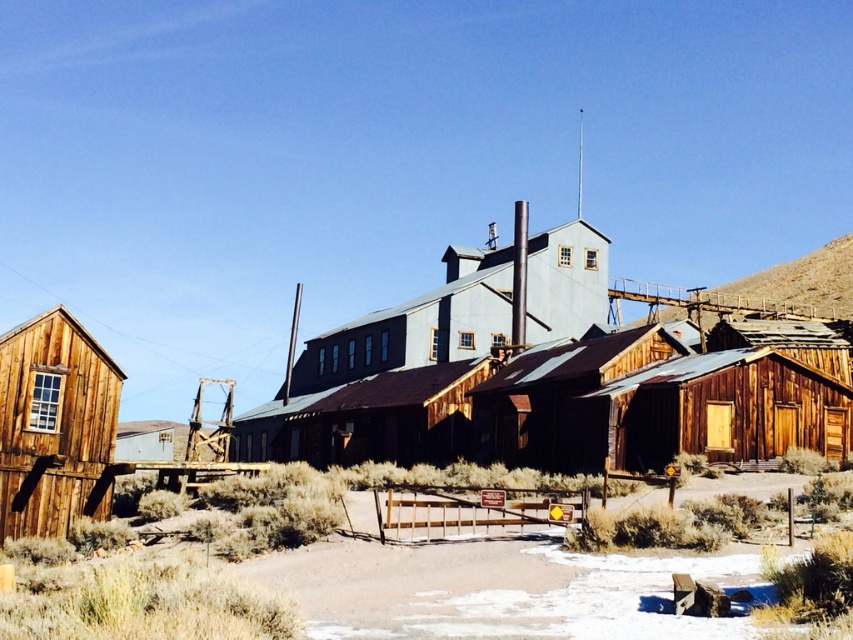
You are standing at the center of the old mining town and want to locate the brown wooden hut at lower right. According to the coordinates provided, where would you find it relative to your current position?

The brown wooden hut at lower right is located at coordinates point (x=711, y=412), which is to the right and slightly below your current position at the center of the old mining town.

You are standing at the entrance of the old mining town and want to locate the wooden hut at center. Based on the coordinates provided, where should you look relative to the main building?

The wooden hut at center is located at coordinates point (564, 403), which means it is positioned to the right and slightly above the main building in the scene.